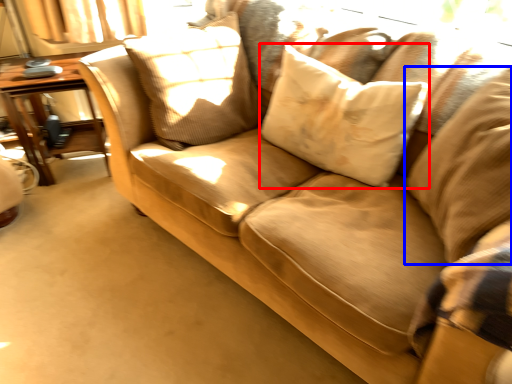
Question: Which object appears farthest to the camera in this image, pillow (highlighted by a red box) or pillow (highlighted by a blue box)?

Choices:
 (A) pillow
 (B) pillow

Answer: (A)